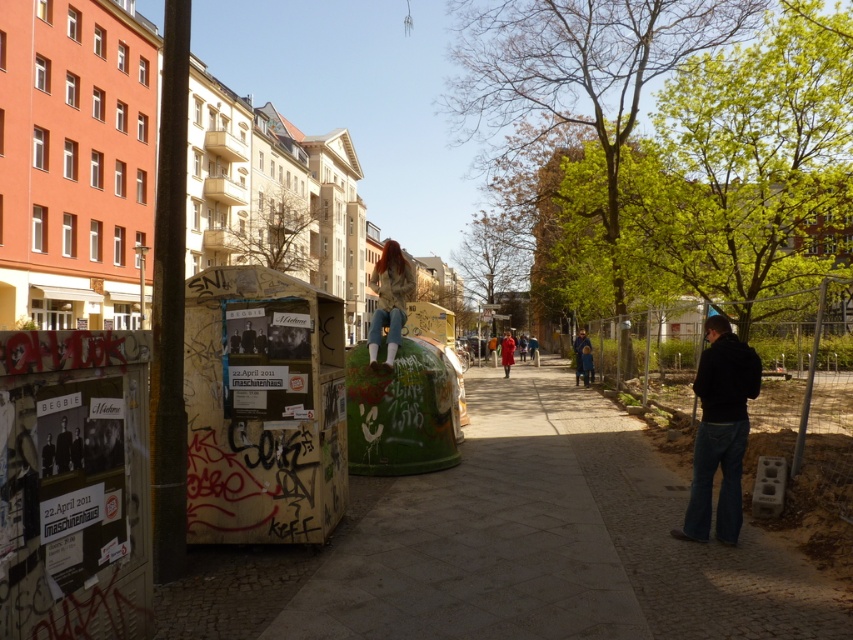
Looking at this image, you are a pedestrian walking along the urban street scene described. You see a light brown leather jacket at center and a blue denim jeans at center. Which item is closer to you?

The light brown leather jacket at center is closer to you because it is in front of the blue denim jeans at center.

You are a delivery person carrying a package and need to step aside to let a pedestrian pass. You see a black cotton hoodie at lower right and blue denim jeans at center. Which object should you move closer to in order to avoid blocking the path?

You should move closer to the blue denim jeans at center because the black cotton hoodie at lower right is in front of it, meaning the blue denim jeans at center is further back and less likely to block the path.

You are standing on the pedestrian walkway in the image. There are two points marked as point 1 at coordinates (697,396) and point 2 at coordinates (386,300). Which point is closer to you?

Point 1 at coordinates (697,396) is closer to you than point 2 at coordinates (386,300) because the description states that point (697,396) is closer to the camera than point (386,300).